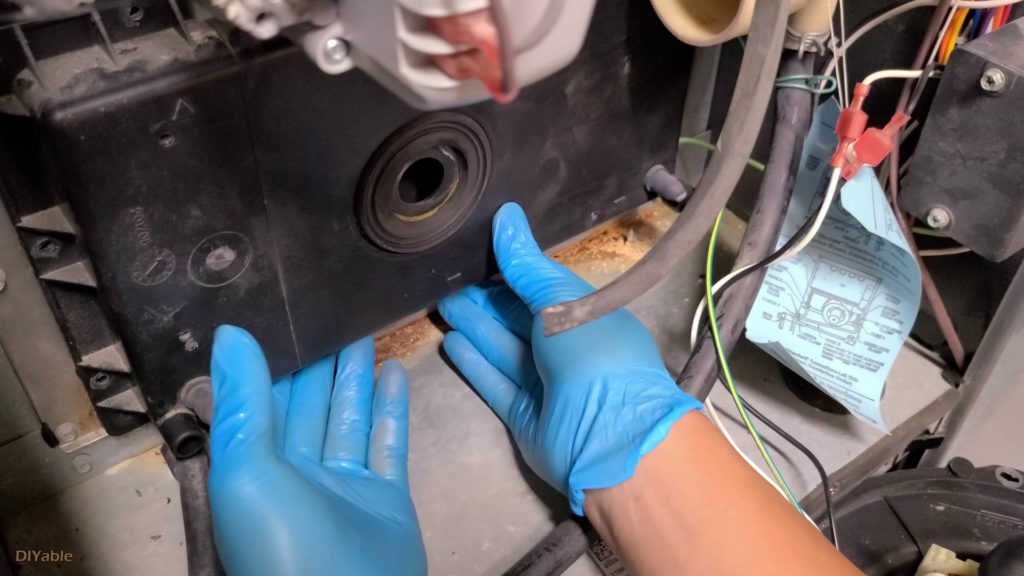
Locate an element on the screen. brown cable is located at coordinates (505, 34), (934, 24).